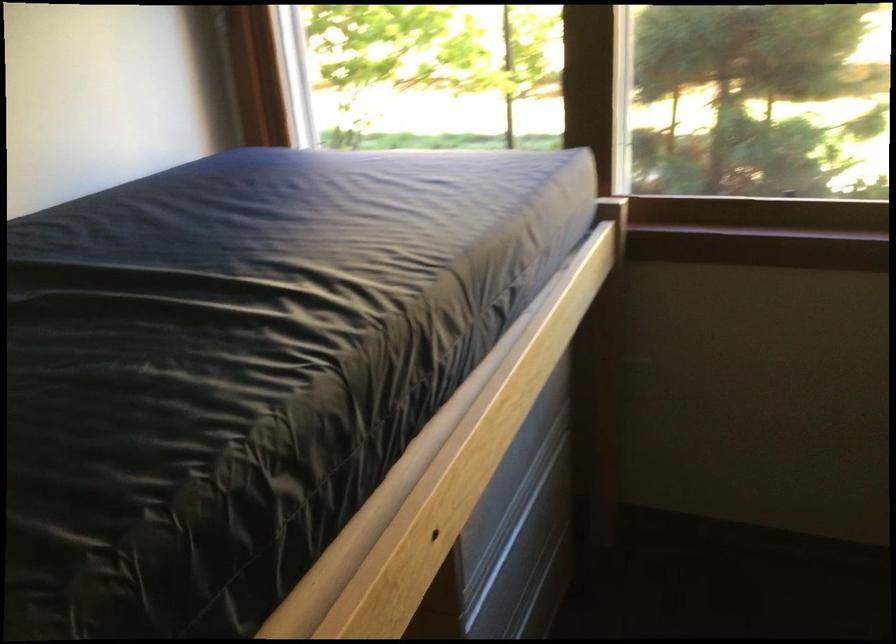
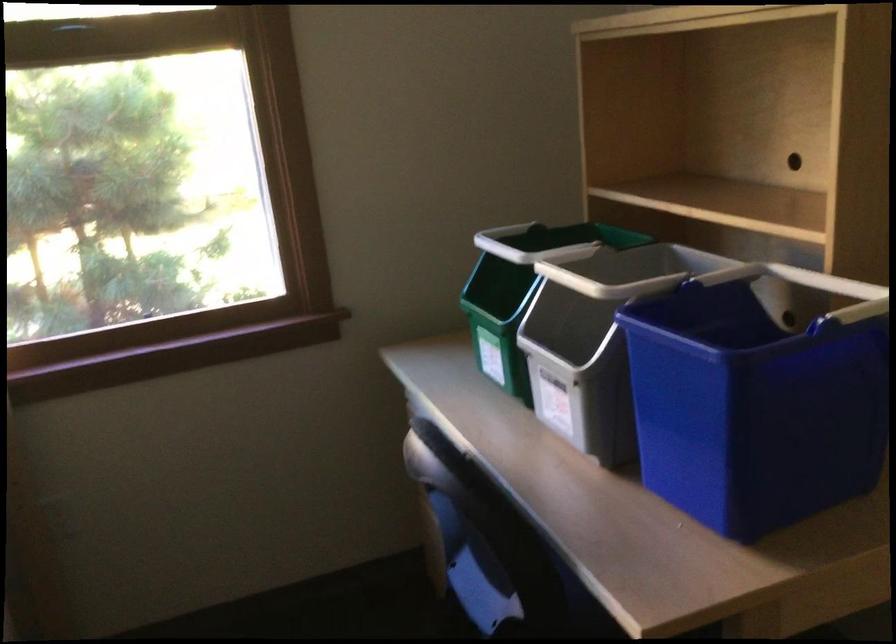
Question: The camera is either moving clockwise (left) or counter-clockwise (right) around the object. The first image is from the beginning of the video and the second image is from the end. Is the camera moving left or right when shooting the video?

Choices:
 (A) Left
 (B) Right

Answer: (A)